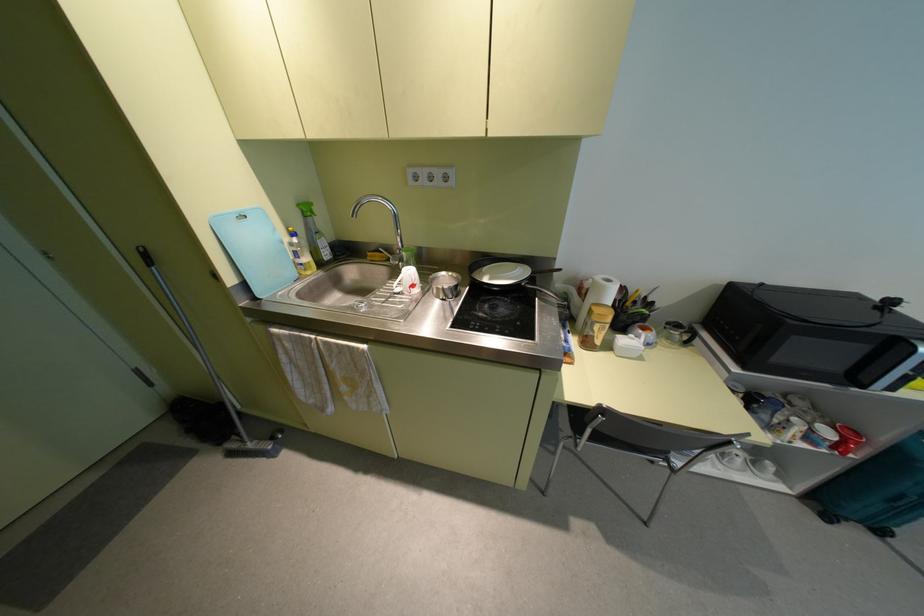
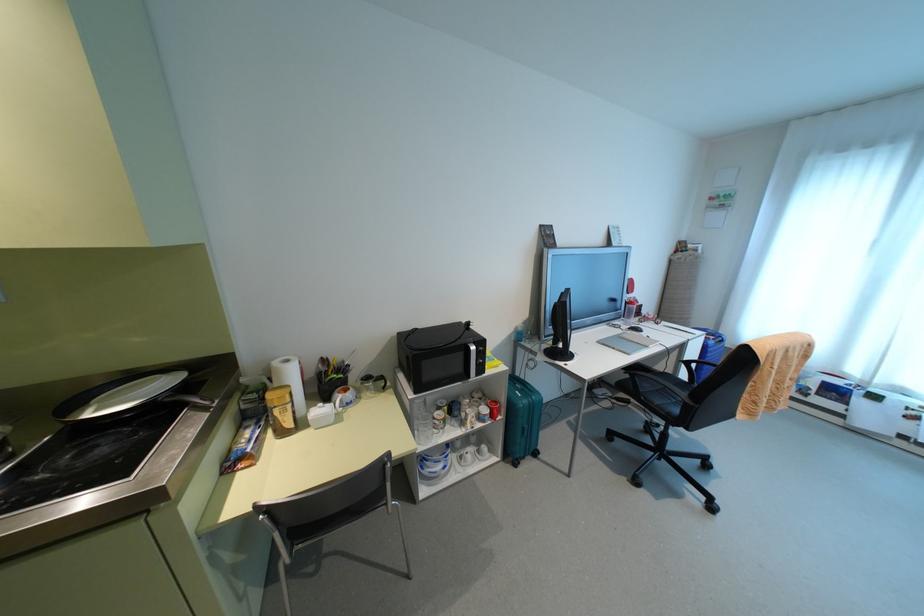
Find the pixel in the second image that matches pixel 768 464 in the first image.

(483, 447)